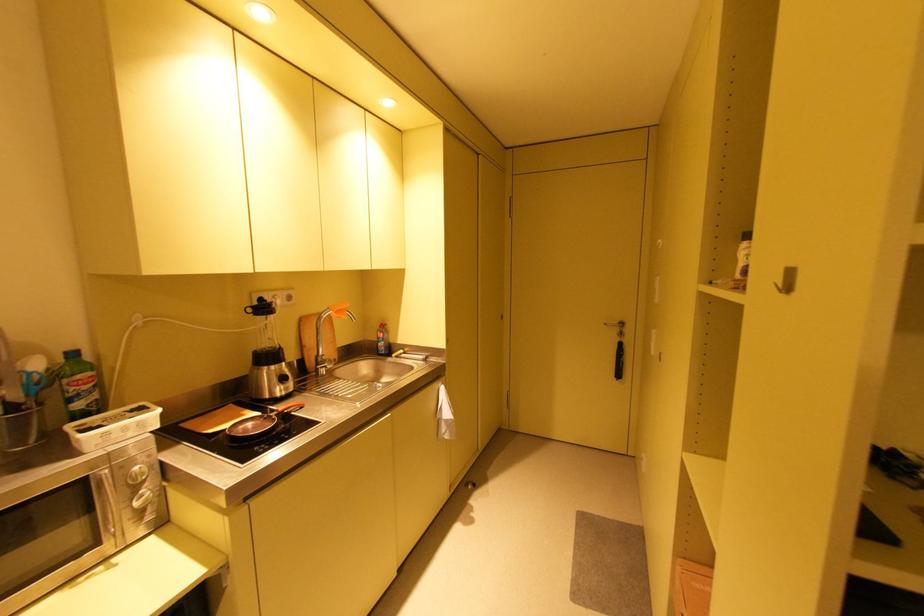
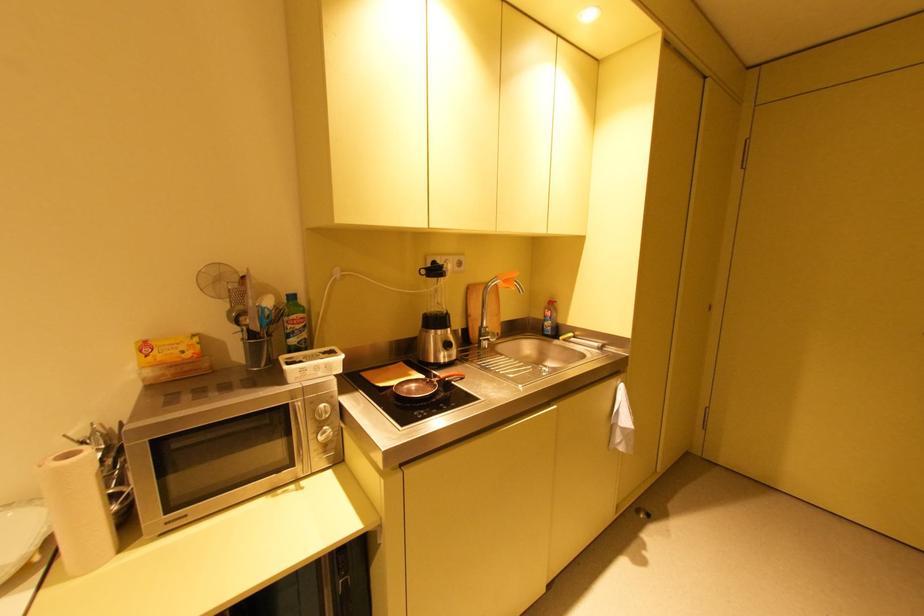
Where in the second image is the point corresponding to (277,367) from the first image?

(444, 331)